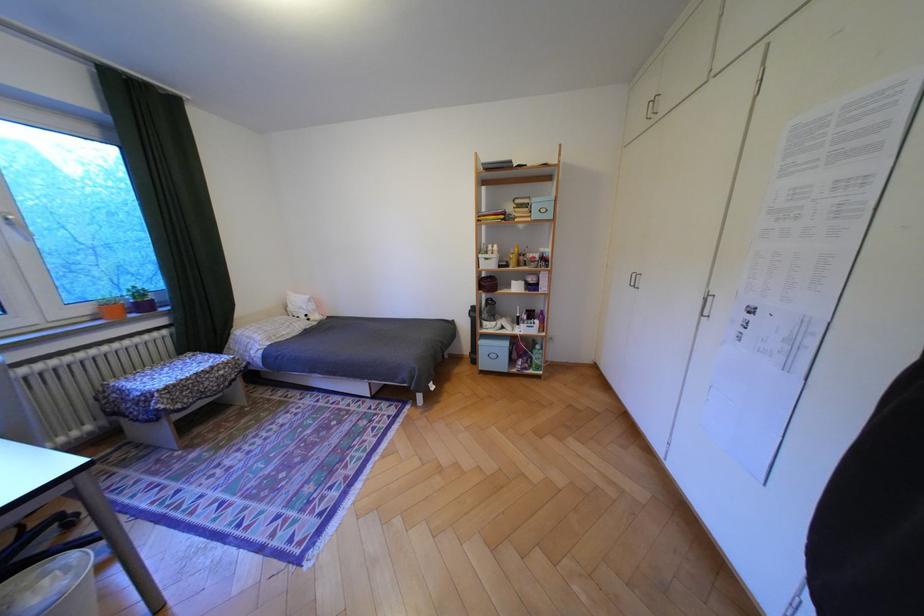
Where is `orange plant pot`? The height and width of the screenshot is (616, 924). orange plant pot is located at coordinates (112, 308).